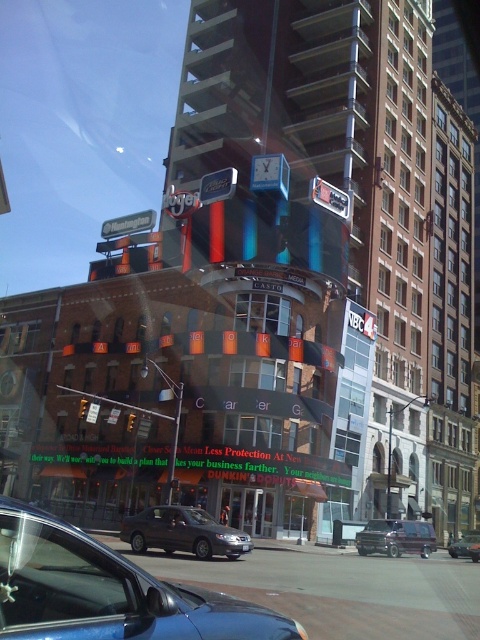
Between point (398, 545) and point (468, 554), which one is positioned behind?

The point (468, 554) is behind.

Is point (384, 548) positioned in front of point (464, 547)?

Yes.

Image resolution: width=480 pixels, height=640 pixels. Find the location of `metallic purple van at center`. metallic purple van at center is located at coordinates (396, 538).

Does dark gray metallic sedan at center come in front of metallic purple van at center?

Yes, dark gray metallic sedan at center is closer to the viewer.

Is point (168, 536) more distant than point (384, 536)?

No, (168, 536) is closer to viewer.

Image resolution: width=480 pixels, height=640 pixels. What are the coordinates of `dark gray metallic sedan at center` in the screenshot? It's located at (182, 532).

Who is more distant from viewer, [163,593] or [155,531]?

The point [155,531] is more distant.

Can you confirm if metallic blue sedan at center is wider than dark gray metallic sedan at center?

Incorrect, metallic blue sedan at center's width does not surpass dark gray metallic sedan at center's.

Who is more forward, (249, 618) or (182, 518)?

Point (249, 618)

This screenshot has width=480, height=640. I want to click on metallic blue sedan at center, so click(x=107, y=592).